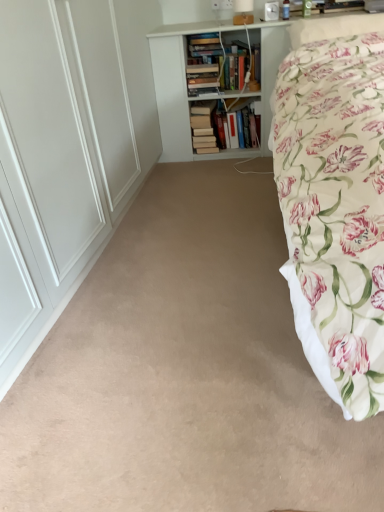
This screenshot has width=384, height=512. Identify the location of beige carpet at center. (185, 372).

Find the location of `floral fabric pillow at upper right`. floral fabric pillow at upper right is located at coordinates (333, 27).

What do you see at coordinates (203, 127) in the screenshot? The height and width of the screenshot is (512, 384). I see `hardcover books at center` at bounding box center [203, 127].

Locate an element on the screen. beige carpet at center is located at coordinates (185, 372).

Considering the relative sizes of white wooden bookcase at upper center and floral fabric bed at right in the image provided, is white wooden bookcase at upper center bigger than floral fabric bed at right?

No, white wooden bookcase at upper center is not bigger than floral fabric bed at right.

Are white wooden bookcase at upper center and floral fabric bed at right far apart?

No, white wooden bookcase at upper center is not far away from floral fabric bed at right.

Which of these two, white wooden bookcase at upper center or floral fabric bed at right, stands shorter?

With less height is floral fabric bed at right.

Which object is further away from the camera taking this photo, white wooden bookcase at upper center or floral fabric bed at right?

Positioned behind is white wooden bookcase at upper center.

Does hardcover books at center have a larger size compared to floral fabric bed at right?

Incorrect, hardcover books at center is not larger than floral fabric bed at right.

Does hardcover books at center come in front of floral fabric bed at right?

No, it is not.

Identify the location of book that is behind the floral fabric bed at right. (203, 127).

How different are the orientations of hardcover books at center and white wooden bookcase at upper center in degrees?

The angular difference between hardcover books at center and white wooden bookcase at upper center is 0.002 degrees.

Could white wooden bookcase at upper center be considered to be inside hardcover books at center?

No, white wooden bookcase at upper center is located outside of hardcover books at center.

From a real-world perspective, between hardcover books at center and white wooden bookcase at upper center, who is vertically lower?

From a 3D spatial view, hardcover books at center is below.

From the image's perspective, is hardcover books at center above or below white wooden bookcase at upper center?

Based on their image positions, hardcover books at center is located beneath white wooden bookcase at upper center.

Is floral fabric bed at right with beige carpet at center?

No, floral fabric bed at right is not beside beige carpet at center.

Which of these two, floral fabric bed at right or beige carpet at center, is bigger?

floral fabric bed at right is bigger.

Is floral fabric bed at right completely or partially outside of beige carpet at center?

Yes, floral fabric bed at right is located beyond the bounds of beige carpet at center.

Locate an element on the screen. The width and height of the screenshot is (384, 512). bed that appears on the right of beige carpet at center is located at coordinates (335, 210).

Are hardcover books at center and beige carpet at center making contact?

hardcover books at center and beige carpet at center are not in contact.

Does hardcover books at center have a lesser height compared to beige carpet at center?

In fact, hardcover books at center may be taller than beige carpet at center.

Is hardcover books at center wider or thinner than beige carpet at center?

In the image, hardcover books at center appears to be more narrow than beige carpet at center.

Which of these two, beige carpet at center or hardcover books at center, is wider?

Wider between the two is beige carpet at center.

Could you tell me if beige carpet at center is facing hardcover books at center?

No, beige carpet at center is not oriented towards hardcover books at center.

Which is nearer, (127,256) or (200,105)?

Positioned in front is point (127,256).

Is beige carpet at center far from hardcover books at center?

Indeed, beige carpet at center is not near hardcover books at center.

How different are the orientations of floral fabric bed at right and hardcover books at center in degrees?

floral fabric bed at right and hardcover books at center are facing 0.00294 degrees away from each other.

Consider the image. Would you consider floral fabric bed at right to be distant from hardcover books at center?

floral fabric bed at right is far away from hardcover books at center.

From the picture: Can we say floral fabric bed at right lies outside hardcover books at center?

floral fabric bed at right lies outside hardcover books at center's area.

Considering the relative sizes of floral fabric bed at right and hardcover books at center in the image provided, is floral fabric bed at right taller than hardcover books at center?

Yes.

The width and height of the screenshot is (384, 512). I want to click on bookcase on the left side of floral fabric bed at right, so click(176, 84).

Locate an element on the screen. bed in front of the hardcover books at center is located at coordinates tap(335, 210).

When comparing their distances from hardcover books at center, does beige carpet at center or floral fabric pillow at upper right seem closer?

Among the two, floral fabric pillow at upper right is located nearer to hardcover books at center.

Based on their spatial positions, is floral fabric pillow at upper right or floral fabric bed at right further from beige carpet at center?

floral fabric pillow at upper right is positioned further to the anchor beige carpet at center.

Which object lies further to the anchor point floral fabric bed at right, floral fabric pillow at upper right or hardcover books at center?

hardcover books at center.

Estimate the real-world distances between objects in this image. Which object is further from floral fabric pillow at upper right, floral fabric bed at right or hardcover books at center?

hardcover books at center is further to floral fabric pillow at upper right.

From the image, which object appears to be nearer to beige carpet at center, floral fabric pillow at upper right or white wooden bookcase at upper center?

Based on the image, white wooden bookcase at upper center appears to be nearer to beige carpet at center.

Estimate the real-world distances between objects in this image. Which object is closer to floral fabric bed at right, beige carpet at center or floral fabric pillow at upper right?

floral fabric pillow at upper right is closer to floral fabric bed at right.

Looking at the image, which one is located closer to white wooden bookcase at upper center, beige carpet at center or hardcover books at center?

The object closer to white wooden bookcase at upper center is hardcover books at center.

Looking at the image, which one is located further to floral fabric bed at right, hardcover books at center or floral fabric pillow at upper right?

hardcover books at center lies further to floral fabric bed at right than the other object.

Image resolution: width=384 pixels, height=512 pixels. In order to click on plain between floral fabric bed at right and floral fabric pillow at upper right from front to back in this screenshot , I will do `click(185, 372)`.

This screenshot has width=384, height=512. I want to click on bookcase between beige carpet at center and hardcover books at center from front to back, so click(x=176, y=84).

You are a GUI agent. You are given a task and a screenshot of the screen. Output one action in this format:
    pyautogui.click(x=<x>, y=<y>)
    Task: Click on the bookcase between floral fabric pillow at upper right and hardcover books at center from front to back
    This screenshot has height=512, width=384.
    Given the screenshot: What is the action you would take?
    pyautogui.click(x=176, y=84)

This screenshot has height=512, width=384. What are the coordinates of `plain between floral fabric bed at right and hardcover books at center in the front-back direction` in the screenshot? It's located at (185, 372).